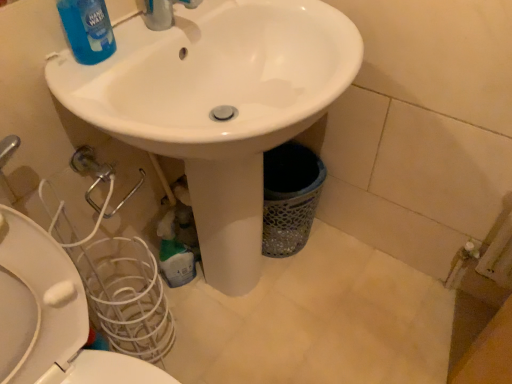
Question: Which direction should I rotate to face green plastic bottle at lower center, the 2th cleaning product viewed from the front, — up or down?

Choices:
 (A) up
 (B) down

Answer: (B)

Question: From the image's perspective, is white glossy sink at center on top of white glossy toilet at lower left?

Choices:
 (A) yes
 (B) no

Answer: (A)

Question: From a real-world perspective, is white glossy sink at center under white glossy toilet at lower left?

Choices:
 (A) yes
 (B) no

Answer: (B)

Question: Would you say white glossy sink at center contains white glossy toilet at lower left?

Choices:
 (A) yes
 (B) no

Answer: (A)

Question: Does white glossy sink at center have a lesser height compared to white glossy toilet at lower left?

Choices:
 (A) no
 (B) yes

Answer: (A)

Question: Is white glossy sink at center beside white glossy toilet at lower left?

Choices:
 (A) no
 (B) yes

Answer: (A)

Question: Is white glossy sink at center far from white glossy toilet at lower left?

Choices:
 (A) yes
 (B) no

Answer: (B)

Question: Does white glossy toilet at lower left appear on the left side of blue glossy liquid at upper left, the second cleaning product when ordered from back to front?

Choices:
 (A) yes
 (B) no

Answer: (A)

Question: Does white glossy toilet at lower left have a lesser width compared to blue glossy liquid at upper left, which ranks as the 1th cleaning product in top-to-bottom order?

Choices:
 (A) yes
 (B) no

Answer: (B)

Question: Can blue glossy liquid at upper left, the second cleaning product when ordered from back to front, be found inside white glossy toilet at lower left?

Choices:
 (A) yes
 (B) no

Answer: (B)

Question: Are white glossy toilet at lower left and blue glossy liquid at upper left, which ranks as the 2th cleaning product in bottom-to-top order, located far from each other?

Choices:
 (A) yes
 (B) no

Answer: (B)

Question: Considering the relative sizes of white glossy toilet at lower left and blue glossy liquid at upper left, which ranks as the 1th cleaning product in top-to-bottom order, in the image provided, is white glossy toilet at lower left shorter than blue glossy liquid at upper left, which ranks as the 1th cleaning product in top-to-bottom order,?

Choices:
 (A) no
 (B) yes

Answer: (A)

Question: Is white glossy toilet at lower left outside blue glossy liquid at upper left, which ranks as the 2th cleaning product in bottom-to-top order?

Choices:
 (A) no
 (B) yes

Answer: (B)

Question: Considering the relative sizes of blue glossy liquid at upper left, which ranks as the 1th cleaning product in top-to-bottom order, and green plastic bottle at lower center, which appears as the 1th cleaning product when viewed from the back, in the image provided, is blue glossy liquid at upper left, which ranks as the 1th cleaning product in top-to-bottom order, smaller than green plastic bottle at lower center, which appears as the 1th cleaning product when viewed from the back,?

Choices:
 (A) yes
 (B) no

Answer: (A)